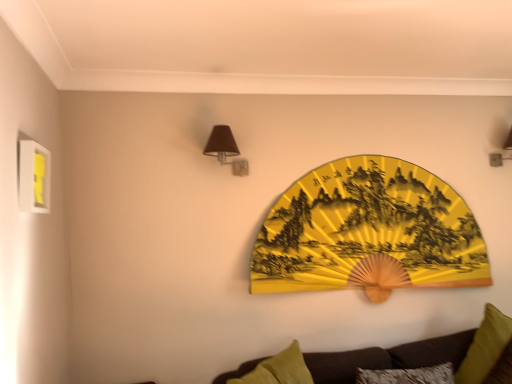
Question: Considering the positions of green fabric pillow at lower right and dark brown fabric couch at lower right in the image, is green fabric pillow at lower right wider or thinner than dark brown fabric couch at lower right?

Choices:
 (A) wide
 (B) thin

Answer: (B)

Question: Looking at the image, does green fabric pillow at lower right seem bigger or smaller compared to dark brown fabric couch at lower right?

Choices:
 (A) small
 (B) big

Answer: (A)

Question: Which object is positioned closest to the yellow paper fan at center?

Choices:
 (A) green fabric pillow at lower right
 (B) matte brown lampshade at upper left, the 1th lamp in the left-to-right sequence
 (C) yellow matte picture frame at upper left
 (D) matte brown wall sconce at upper right, which is the 2th lamp in left-to-right order
 (E) dark brown fabric couch at lower right

Answer: (E)

Question: Estimate the real-world distances between objects in this image. Which object is closer to the matte brown wall sconce at upper right, marked as the second lamp in a front-to-back arrangement?

Choices:
 (A) matte brown lampshade at upper left, the 1th lamp in the left-to-right sequence
 (B) yellow paper fan at center
 (C) yellow matte picture frame at upper left
 (D) dark brown fabric couch at lower right
 (E) green fabric pillow at lower right

Answer: (B)